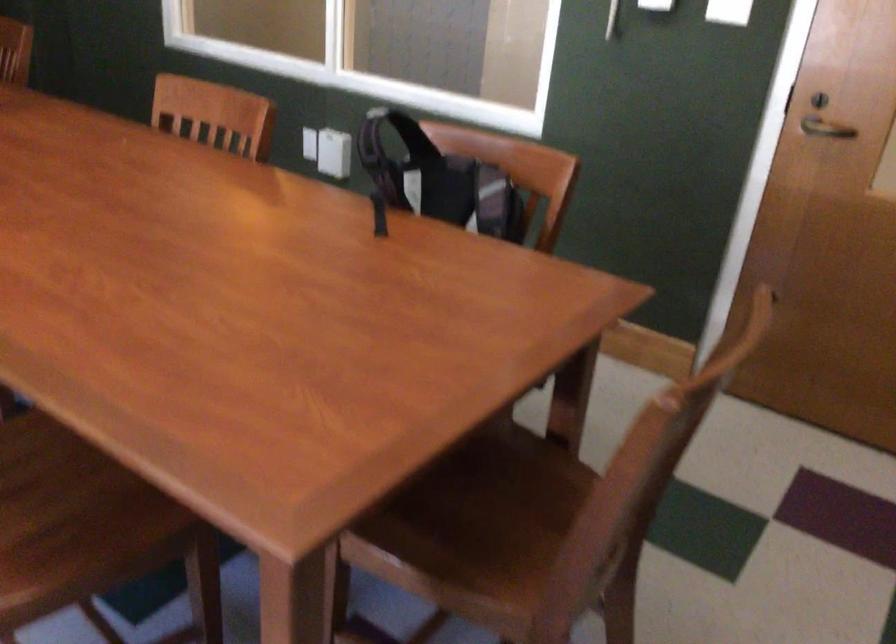
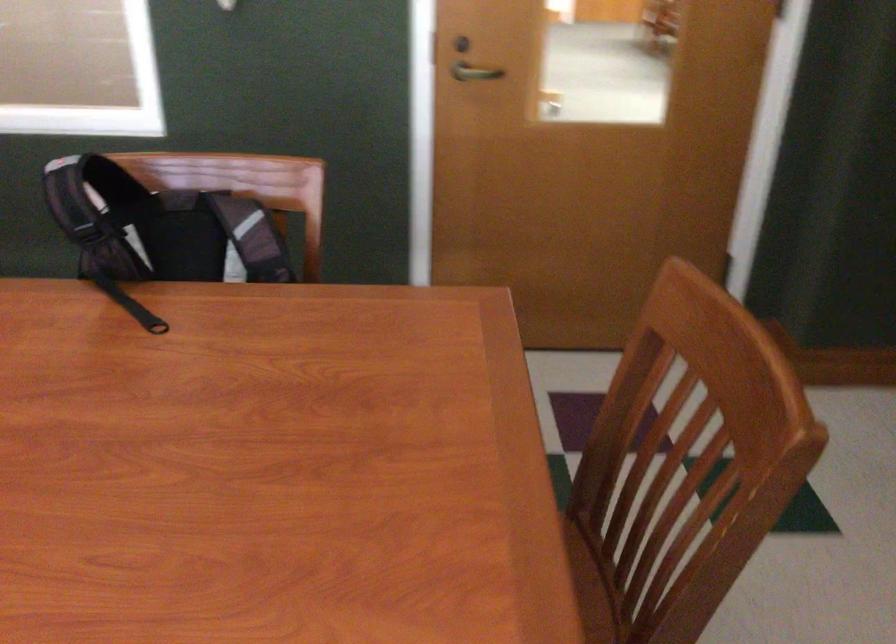
Question: The camera is either moving clockwise (left) or counter-clockwise (right) around the object. The first image is from the beginning of the video and the second image is from the end. Is the camera moving left or right when shooting the video?

Choices:
 (A) Left
 (B) Right

Answer: (A)